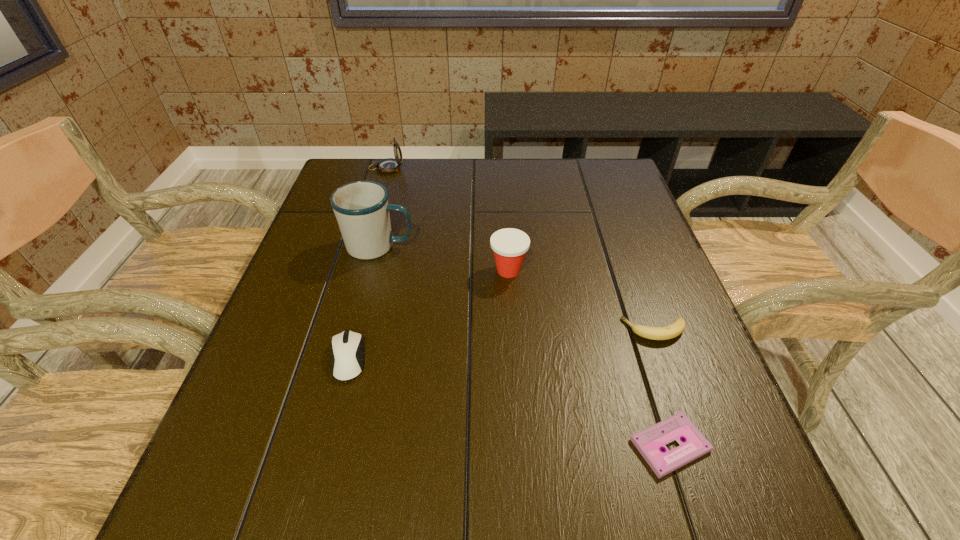
Locate an element on the screen. The height and width of the screenshot is (540, 960). free point between the compass and the nearest object is located at coordinates (528, 307).

Where is `free spot between the Dixie cup and the fourth tallest object`? The height and width of the screenshot is (540, 960). free spot between the Dixie cup and the fourth tallest object is located at coordinates (428, 314).

Locate an element on the screen. The image size is (960, 540). free spot between the third object from right to left and the mouse is located at coordinates (428, 314).

This screenshot has height=540, width=960. I want to click on empty space that is in between the third shortest object and the farthest object, so click(367, 264).

Identify the location of free space between the compass and the mouse. (367, 264).

Find the location of `vacant area between the tallest object and the third shortest object`. vacant area between the tallest object and the third shortest object is located at coordinates (364, 302).

Locate an element on the screen. The width and height of the screenshot is (960, 540). object that is the closest to the Dixie cup is located at coordinates (361, 208).

Identify which object is the fifth nearest to the compass. Please provide its 2D coordinates. Your answer should be formatted as a tuple, i.e. [(x, y)], where the tuple contains the x and y coordinates of a point satisfying the conditions above.

[(649, 442)]

The image size is (960, 540). I want to click on free space that satisfies the following two spatial constraints: 1. on the handle side of the mug; 2. on the right side of the nearest object, so click(x=329, y=445).

At what (x,y) coordinates should I click in order to perform the action: click on vacant area in the image that satisfies the following two spatial constraints: 1. on the handle side of the nearest object; 2. on the right side of the tallest object. Please return your answer as a coordinate pair (x, y). This screenshot has width=960, height=540. Looking at the image, I should click on (329, 445).